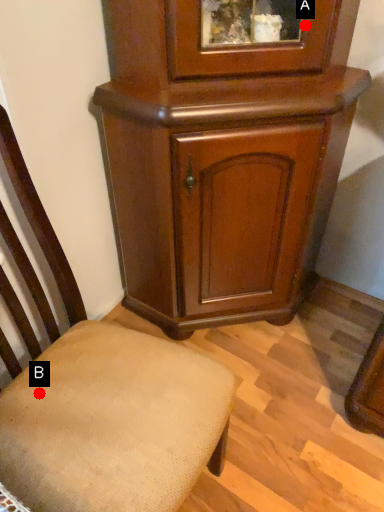
Question: Two points are circled on the image, labeled by A and B beside each circle. Among these points, which one is farthest from the camera?

Choices:
 (A) A is further
 (B) B is further

Answer: (A)